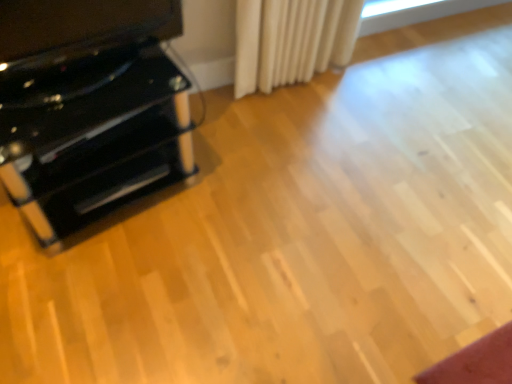
Question: Is black plastic drawer at left bigger than glossy black cabinet at left?

Choices:
 (A) no
 (B) yes

Answer: (A)

Question: Is black plastic drawer at left further to camera compared to glossy black cabinet at left?

Choices:
 (A) yes
 (B) no

Answer: (A)

Question: From a real-world perspective, is black plastic drawer at left below glossy black cabinet at left?

Choices:
 (A) yes
 (B) no

Answer: (A)

Question: From the image's perspective, would you say black plastic drawer at left is shown under glossy black cabinet at left?

Choices:
 (A) yes
 (B) no

Answer: (A)

Question: From a real-world perspective, is black plastic drawer at left physically above glossy black cabinet at left?

Choices:
 (A) yes
 (B) no

Answer: (B)

Question: In terms of height, does black glossy tv stand at left look taller or shorter compared to black plastic drawer at left?

Choices:
 (A) short
 (B) tall

Answer: (B)

Question: From a real-world perspective, is black glossy tv stand at left above or below black plastic drawer at left?

Choices:
 (A) above
 (B) below

Answer: (A)

Question: Is point (17, 41) positioned closer to the camera than point (96, 200)?

Choices:
 (A) closer
 (B) farther

Answer: (A)

Question: Looking at the image, does black glossy tv stand at left seem bigger or smaller compared to black plastic drawer at left?

Choices:
 (A) big
 (B) small

Answer: (A)

Question: Looking at their shapes, would you say black plastic drawer at left is wider or thinner than black glossy tv stand at left?

Choices:
 (A) wide
 (B) thin

Answer: (A)

Question: Which is correct: black plastic drawer at left is inside black glossy tv stand at left, or outside of it?

Choices:
 (A) inside
 (B) outside

Answer: (B)

Question: Is point [187, 135] positioned closer to the camera than point [26, 56]?

Choices:
 (A) closer
 (B) farther

Answer: (B)

Question: From a real-world perspective, relative to black glossy tv stand at left, is black plastic drawer at left vertically above or below?

Choices:
 (A) below
 (B) above

Answer: (A)

Question: Is glossy black cabinet at left bigger or smaller than black glossy tv stand at left?

Choices:
 (A) small
 (B) big

Answer: (B)

Question: Is glossy black cabinet at left inside or outside of black glossy tv stand at left?

Choices:
 (A) inside
 (B) outside

Answer: (B)